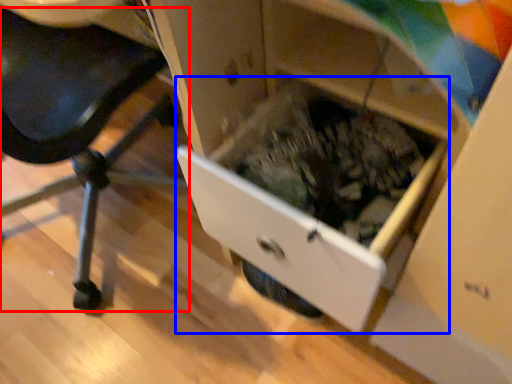
Question: Which of the following is the closest to the observer, furniture (highlighted by a red box) or drawer (highlighted by a blue box)?

Choices:
 (A) furniture
 (B) drawer

Answer: (A)